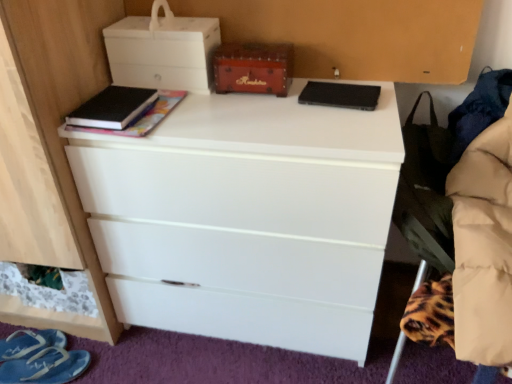
Question: Is white matte chest of drawers at center located within blue fabric sandal at lower left, the first footwear positioned from the back?

Choices:
 (A) no
 (B) yes

Answer: (A)

Question: Can you confirm if blue fabric sandal at lower left, which ranks as the 2th footwear in front-to-back order, is thinner than white matte chest of drawers at center?

Choices:
 (A) yes
 (B) no

Answer: (A)

Question: From the image's perspective, is blue fabric sandal at lower left, the first footwear positioned from the back, located above white matte chest of drawers at center?

Choices:
 (A) yes
 (B) no

Answer: (B)

Question: Is blue fabric sandal at lower left, the first footwear positioned from the back, aimed at white matte chest of drawers at center?

Choices:
 (A) no
 (B) yes

Answer: (B)

Question: Does blue fabric sandal at lower left, which ranks as the 2th footwear in front-to-back order, have a smaller size compared to white matte chest of drawers at center?

Choices:
 (A) yes
 (B) no

Answer: (A)

Question: Considering the positions of black matte book at upper left, which ranks as the first book in left-to-right order, and white matte chest of drawers at center in the image, is black matte book at upper left, which ranks as the first book in left-to-right order, bigger or smaller than white matte chest of drawers at center?

Choices:
 (A) big
 (B) small

Answer: (B)

Question: Looking at their shapes, would you say black matte book at upper left, acting as the 2th book starting from the right, is wider or thinner than white matte chest of drawers at center?

Choices:
 (A) wide
 (B) thin

Answer: (B)

Question: Does point [x=129, y=97] appear closer or farther from the camera than point [x=266, y=241]?

Choices:
 (A) farther
 (B) closer

Answer: (A)

Question: Would you say black matte book at upper left, which ranks as the first book in left-to-right order, is to the left or to the right of white matte chest of drawers at center in the picture?

Choices:
 (A) left
 (B) right

Answer: (A)

Question: Is black matte speaker at upper center, placed as the first book when sorted from right to left, situated inside blue fabric sandal at lower left, the first footwear positioned from the back, or outside?

Choices:
 (A) inside
 (B) outside

Answer: (B)

Question: In terms of width, does black matte speaker at upper center, placed as the first book when sorted from right to left, look wider or thinner when compared to blue fabric sandal at lower left, which ranks as the 2th footwear in front-to-back order?

Choices:
 (A) thin
 (B) wide

Answer: (A)

Question: Is point (324, 84) positioned closer to the camera than point (35, 339)?

Choices:
 (A) farther
 (B) closer

Answer: (B)

Question: From the image's perspective, is black matte speaker at upper center, the second book viewed from the left, located above or below blue fabric sandal at lower left, the first footwear positioned from the back?

Choices:
 (A) above
 (B) below

Answer: (A)

Question: Is black matte book at upper left, which ranks as the first book in left-to-right order, taller or shorter than blue fabric sandal at lower left, the first footwear positioned from the back?

Choices:
 (A) short
 (B) tall

Answer: (A)

Question: Based on their sizes in the image, would you say black matte book at upper left, which ranks as the first book in left-to-right order, is bigger or smaller than blue fabric sandal at lower left, which ranks as the 2th footwear in front-to-back order?

Choices:
 (A) small
 (B) big

Answer: (A)